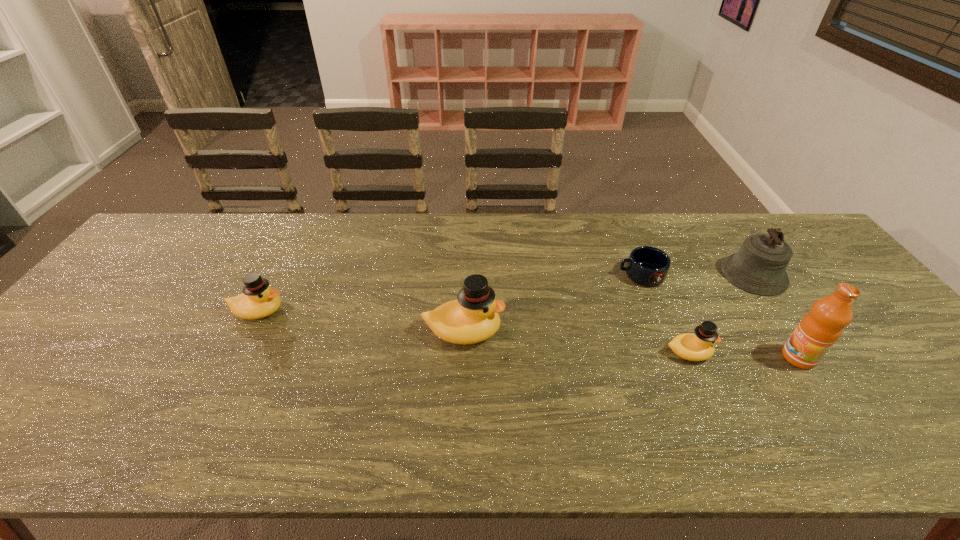
This screenshot has height=540, width=960. In order to click on vacant position located on the front-facing side of the tallest duck in this screenshot , I will do `click(651, 331)`.

The height and width of the screenshot is (540, 960). Find the location of `vacant region located 0.190m on the front-facing side of the shortest duck`. vacant region located 0.190m on the front-facing side of the shortest duck is located at coordinates (790, 353).

Where is `free space located with the handle on the side of the mug`? The width and height of the screenshot is (960, 540). free space located with the handle on the side of the mug is located at coordinates (584, 275).

Locate an element on the screen. The image size is (960, 540). vacant space located 0.220m with the handle on the side of the mug is located at coordinates (543, 275).

Where is `vacant position located 0.130m with the handle on the side of the mug`? vacant position located 0.130m with the handle on the side of the mug is located at coordinates (574, 275).

This screenshot has width=960, height=540. Find the location of `vacant space located 0.290m on the front of the bell`. vacant space located 0.290m on the front of the bell is located at coordinates (829, 384).

This screenshot has width=960, height=540. In order to click on free space located on the label side of the fruit juice in this screenshot , I will do `click(636, 357)`.

You are a GUI agent. You are given a task and a screenshot of the screen. Output one action in this format:
    pyautogui.click(x=<x>, y=<y>)
    Task: Click on the free spot located 0.280m on the label side of the fruit juice
    The height and width of the screenshot is (540, 960).
    Given the screenshot: What is the action you would take?
    pyautogui.click(x=668, y=357)

The width and height of the screenshot is (960, 540). Find the location of `free spot located on the label side of the fruit juice`. free spot located on the label side of the fruit juice is located at coordinates (701, 357).

I want to click on object present at the far edge, so coord(759,267).